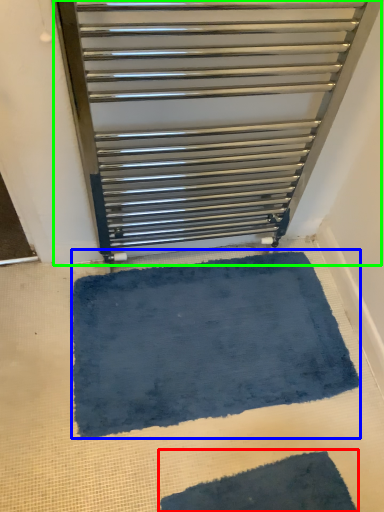
Question: Considering the real-world distances, which object is farthest from bath mat (highlighted by a red box)? bath mat (highlighted by a blue box) or furniture (highlighted by a green box)?

Choices:
 (A) bath mat
 (B) furniture

Answer: (B)